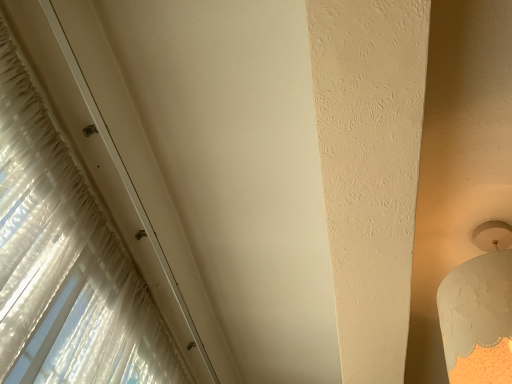
Identify the location of white paper lampshade at right. (479, 310).

Describe the element at coordinates (479, 310) in the screenshot. I see `white paper lampshade at right` at that location.

Measure the distance between point (458, 269) and camera.

They are 33.62 inches apart.

Locate an element on the screen. This screenshot has width=512, height=384. white paper lampshade at right is located at coordinates (479, 310).